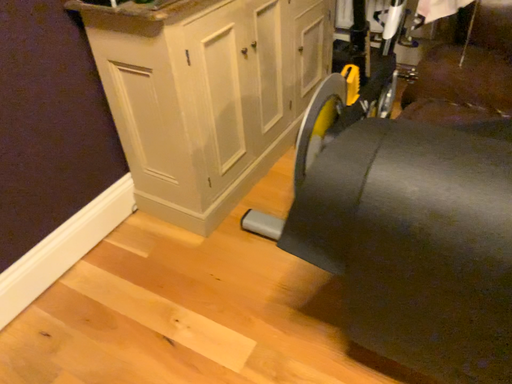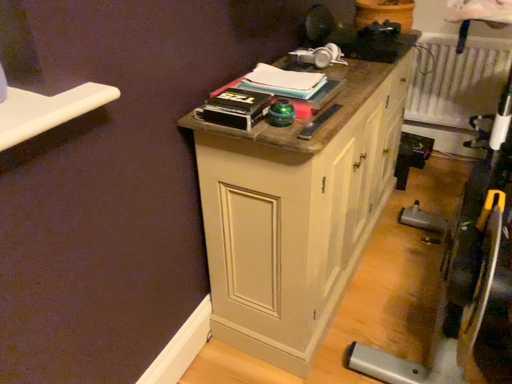
Question: How did the camera likely rotate when shooting the video?

Choices:
 (A) rotated upward
 (B) rotated downward

Answer: (A)